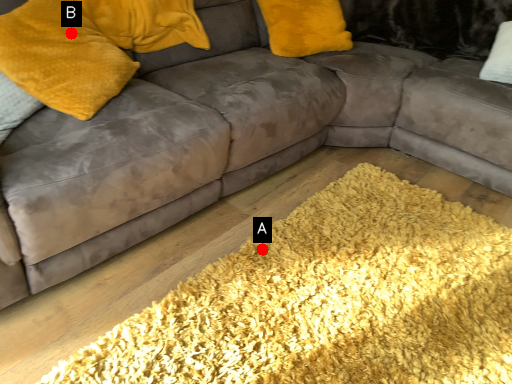
Question: Two points are circled on the image, labeled by A and B beside each circle. Which of the following is the farthest from the observer?

Choices:
 (A) A is further
 (B) B is further

Answer: (A)